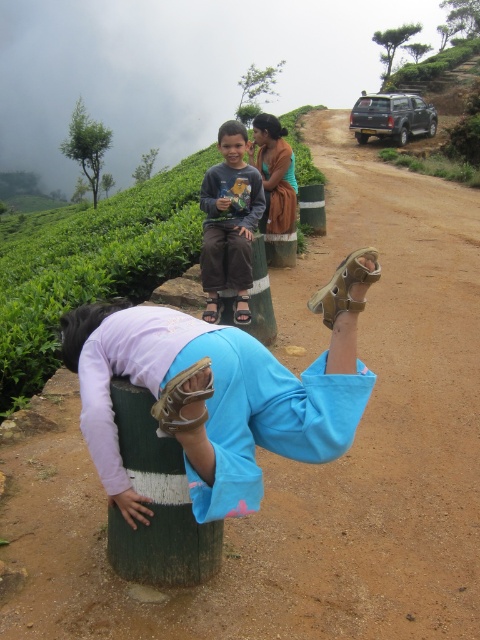
You are a photographer trying to capture the scene from the ground level. Which object, the green wood pole at lower center or the brown textured dress at upper center, would appear closer to your camera lens?

The green wood pole at lower center appears closer to the camera lens because it is positioned under the brown textured dress at upper center, placing it in the foreground.

In the scene shown: You are standing at the point with coordinates point [273,140] and want to walk to the point with coordinates point [190,576]. Which direction should you move in?

You should move forward because point [190,576] is in front of point [273,140].